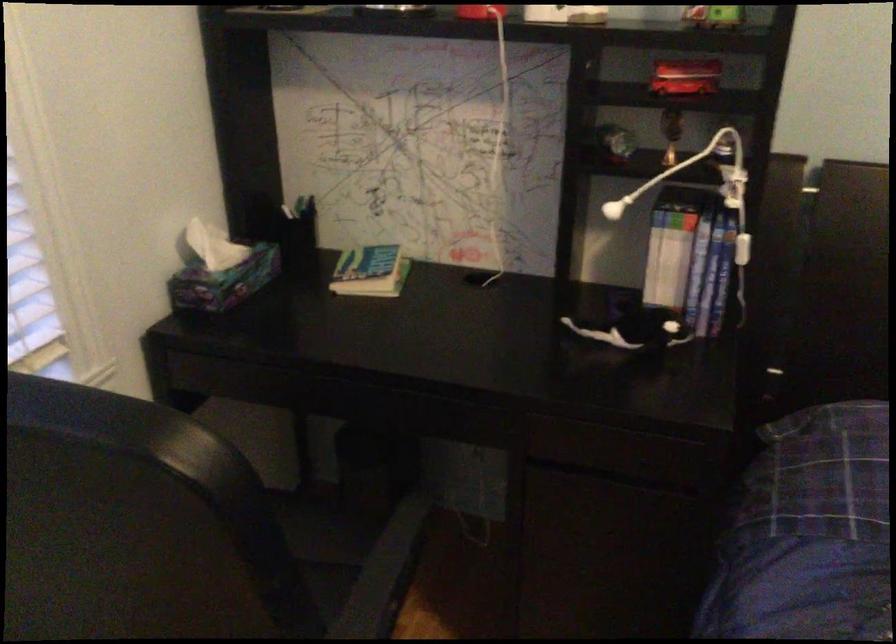
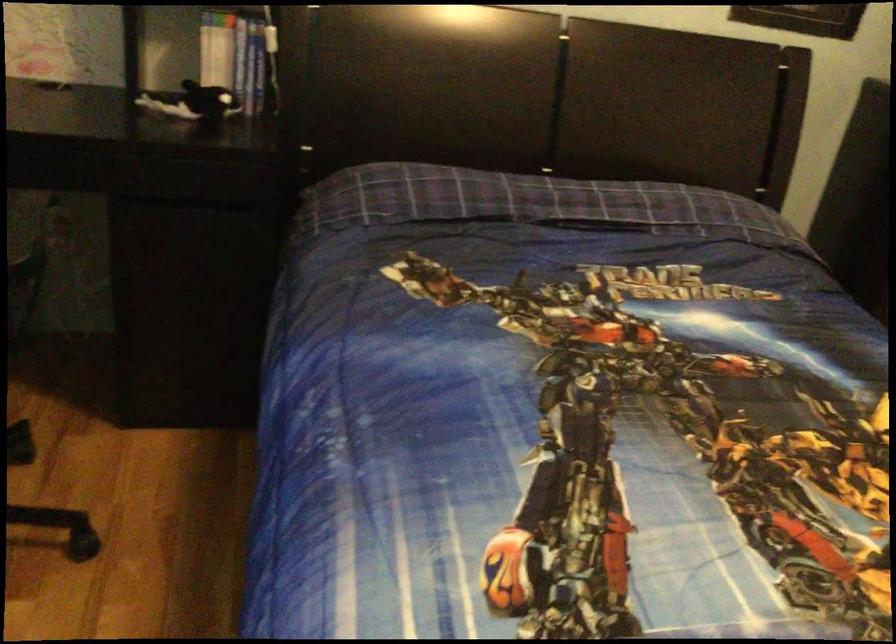
Question: The camera is either moving clockwise (left) or counter-clockwise (right) around the object. The first image is from the beginning of the video and the second image is from the end. Is the camera moving left or right when shooting the video?

Choices:
 (A) Left
 (B) Right

Answer: (A)